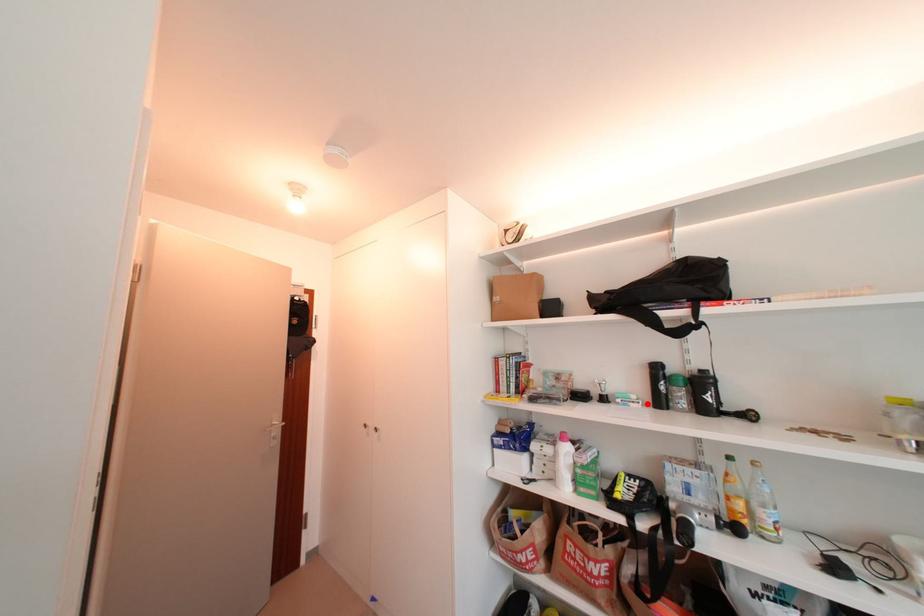
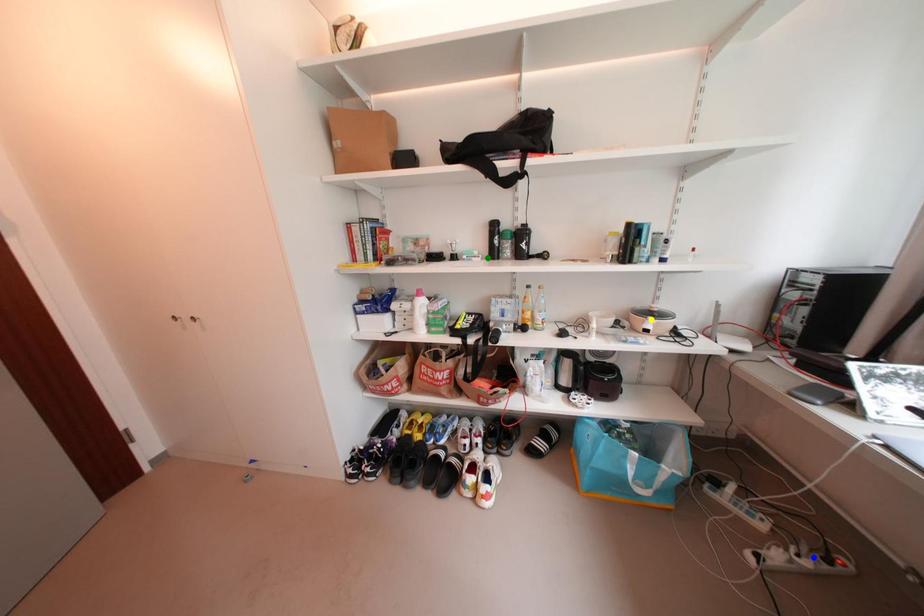
Question: I am providing you with two images of the same scene from different viewpoints. A red point is marked on the first image. You are given multiple points on the second image. Can you choose the point in image 2 that corresponds to the point in image 1?

Choices:
 (A) green point
 (B) yellow point
 (C) blue point

Answer: (A)